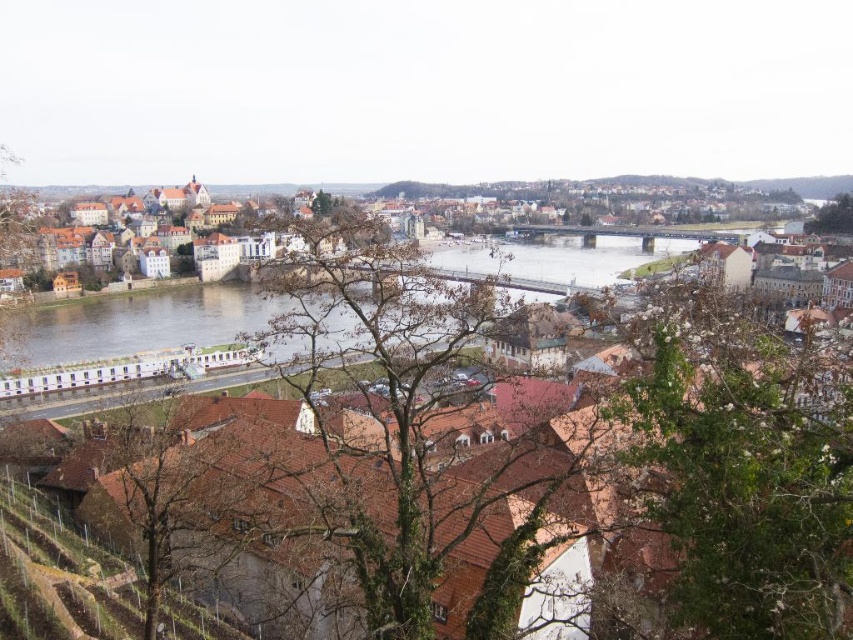
Question: Which point appears farthest from the camera in this image?

Choices:
 (A) (836, 221)
 (B) (769, 184)

Answer: (B)

Question: Can you confirm if brown leafless tree at center is positioned to the left of brown tiled roofs at center?

Choices:
 (A) yes
 (B) no

Answer: (A)

Question: Estimate the real-world distances between objects in this image. Which object is farther from the brown leafless tree at lower left?

Choices:
 (A) brown tiled roofs at center
 (B) green leafy tree at upper right
 (C) green leafy tree at lower right

Answer: (B)

Question: Which of these objects is positioned farthest from the green leafy tree at lower right?

Choices:
 (A) brown leafless tree at lower left
 (B) green leafy tree at upper right
 (C) brown tiled roofs at center
 (D) brown leafless tree at center

Answer: (B)

Question: Does brown leafless tree at center lie behind brown leafless tree at lower left?

Choices:
 (A) yes
 (B) no

Answer: (B)

Question: Does brown tiled roofs at center lie in front of brown leafless tree at lower left?

Choices:
 (A) no
 (B) yes

Answer: (A)